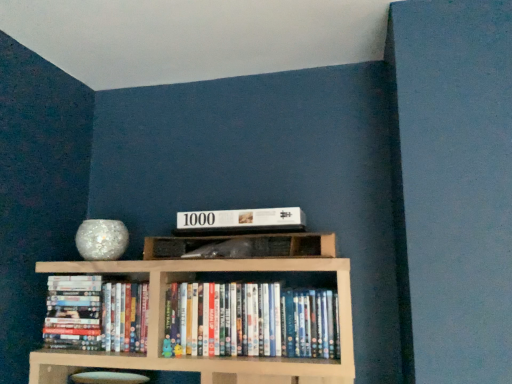
The width and height of the screenshot is (512, 384). Describe the element at coordinates (246, 239) in the screenshot. I see `wooden shelf at center` at that location.

At what (x,y) coordinates should I click in order to perform the action: click on white glossy dvd case at center, acting as the 2th book starting from the left. Please return your answer as a coordinate pair (x, y). Looking at the image, I should click on (250, 321).

From the image's perspective, between white matte puzzle box at center and white glossy dvd case at center, the first book when ordered from right to left, who is located below?

white glossy dvd case at center, the first book when ordered from right to left.

Is white matte puzzle box at center wider or thinner than white glossy dvd case at center, the first book when ordered from right to left?

In the image, white matte puzzle box at center appears to be wider than white glossy dvd case at center, the first book when ordered from right to left.

From a real-world perspective, is white matte puzzle box at center physically located above or below white glossy dvd case at center, the first book when ordered from right to left?

From a real-world perspective, white matte puzzle box at center is physically above white glossy dvd case at center, the first book when ordered from right to left.

Can you confirm if white matte puzzle box at center is bigger than white glossy dvd case at center, the first book when ordered from right to left?

Actually, white matte puzzle box at center might be smaller than white glossy dvd case at center, the first book when ordered from right to left.

Is hardcover books at center, acting as the 2th book starting from the right, facing towards white glossy dvd case at center, acting as the 2th book starting from the left?

No, hardcover books at center, acting as the 2th book starting from the right, is not oriented towards white glossy dvd case at center, acting as the 2th book starting from the left.

Can you tell me how much hardcover books at center, placed as the 1th book when sorted from left to right, and white glossy dvd case at center, the first book when ordered from right to left, differ in facing direction?

There is a 0.000486-degree angle between the facing directions of hardcover books at center, placed as the 1th book when sorted from left to right, and white glossy dvd case at center, the first book when ordered from right to left.

Where is `book behind the white glossy dvd case at center, the first book when ordered from right to left`? This screenshot has height=384, width=512. book behind the white glossy dvd case at center, the first book when ordered from right to left is located at coordinates (96, 314).

Considering the positions of objects hardcover books at center, placed as the 1th book when sorted from left to right, and white glossy dvd case at center, the first book when ordered from right to left, in the image provided, who is in front, hardcover books at center, placed as the 1th book when sorted from left to right, or white glossy dvd case at center, the first book when ordered from right to left,?

white glossy dvd case at center, the first book when ordered from right to left.

Is wooden shelf at center shorter than white glossy dvd case at center, the first book when ordered from right to left?

Yes, wooden shelf at center is shorter than white glossy dvd case at center, the first book when ordered from right to left.

Does wooden shelf at center turn towards white glossy dvd case at center, the first book when ordered from right to left?

No, wooden shelf at center is not aimed at white glossy dvd case at center, the first book when ordered from right to left.

In the scene shown: From the image's perspective, which is above, wooden shelf at center or white glossy dvd case at center, acting as the 2th book starting from the left?

wooden shelf at center is shown above in the image.

Which is in front, wooden shelf at center or white glossy dvd case at center, acting as the 2th book starting from the left?

wooden shelf at center.

Does hardcover books at center, placed as the 1th book when sorted from left to right, have a greater width compared to white matte puzzle box at center?

In fact, hardcover books at center, placed as the 1th book when sorted from left to right, might be narrower than white matte puzzle box at center.

Is hardcover books at center, acting as the 2th book starting from the right, in front of or behind white matte puzzle box at center in the image?

hardcover books at center, acting as the 2th book starting from the right, is positioned farther from the viewer than white matte puzzle box at center.

Is hardcover books at center, acting as the 2th book starting from the right, next to white matte puzzle box at center?

There is a gap between hardcover books at center, acting as the 2th book starting from the right, and white matte puzzle box at center.

From a real-world perspective, is white glossy dvd case at center, acting as the 2th book starting from the left, positioned over hardcover books at center, acting as the 2th book starting from the right, based on gravity?

No, from a real-world perspective, white glossy dvd case at center, acting as the 2th book starting from the left, is not on top of hardcover books at center, acting as the 2th book starting from the right.

Are white glossy dvd case at center, acting as the 2th book starting from the left, and hardcover books at center, placed as the 1th book when sorted from left to right, located far from each other?

Actually, white glossy dvd case at center, acting as the 2th book starting from the left, and hardcover books at center, placed as the 1th book when sorted from left to right, are a little close together.

Does point (316, 299) lie behind point (106, 305)?

No, it is in front of (106, 305).

Is hardcover books at center, placed as the 1th book when sorted from left to right, at the back of white glossy dvd case at center, the first book when ordered from right to left?

That's not correct — white glossy dvd case at center, the first book when ordered from right to left, is not looking away from hardcover books at center, placed as the 1th book when sorted from left to right.

Considering the relative sizes of wooden shelf at center and hardcover books at center, acting as the 2th book starting from the right, in the image provided, is wooden shelf at center bigger than hardcover books at center, acting as the 2th book starting from the right,?

Incorrect, wooden shelf at center is not larger than hardcover books at center, acting as the 2th book starting from the right.

Is wooden shelf at center facing away from hardcover books at center, placed as the 1th book when sorted from left to right?

No, wooden shelf at center's orientation is not away from hardcover books at center, placed as the 1th book when sorted from left to right.

Would you say wooden shelf at center is a long distance from hardcover books at center, acting as the 2th book starting from the right?

No, wooden shelf at center is in close proximity to hardcover books at center, acting as the 2th book starting from the right.

Considering the sizes of wooden shelf at center and white matte puzzle box at center in the image, is wooden shelf at center bigger or smaller than white matte puzzle box at center?

wooden shelf at center is bigger than white matte puzzle box at center.

Is wooden shelf at center aimed at white matte puzzle box at center?

No, wooden shelf at center is not turned towards white matte puzzle box at center.

Based on the photo, who is taller, wooden shelf at center or white matte puzzle box at center?

wooden shelf at center.

This screenshot has width=512, height=384. What are the coordinates of `the 2nd book located beneath the white matte puzzle box at center (from a real-world perspective)` in the screenshot? It's located at (250, 321).

The image size is (512, 384). In order to click on book located above the hardcover books at center, acting as the 2th book starting from the right (from the image's perspective) in this screenshot , I will do (x=250, y=321).

From the image, which object appears to be farther from wooden shelf at center, white matte puzzle box at center or hardcover books at center, acting as the 2th book starting from the right?

Based on the image, hardcover books at center, acting as the 2th book starting from the right, appears to be further to wooden shelf at center.

From the image, which object appears to be nearer to hardcover books at center, placed as the 1th book when sorted from left to right, white matte puzzle box at center or wooden shelf at center?

wooden shelf at center.

Based on their spatial positions, is white glossy dvd case at center, the first book when ordered from right to left, or wooden shelf at center closer to white matte puzzle box at center?

Based on the image, wooden shelf at center appears to be nearer to white matte puzzle box at center.

Considering their positions, is white matte puzzle box at center positioned closer to wooden shelf at center than white glossy dvd case at center, the first book when ordered from right to left?

white matte puzzle box at center.

When comparing their distances from white matte puzzle box at center, does hardcover books at center, placed as the 1th book when sorted from left to right, or wooden shelf at center seem further?

hardcover books at center, placed as the 1th book when sorted from left to right.

Which object lies nearer to the anchor point hardcover books at center, placed as the 1th book when sorted from left to right, white glossy dvd case at center, acting as the 2th book starting from the left, or white matte puzzle box at center?

white glossy dvd case at center, acting as the 2th book starting from the left, is closer to hardcover books at center, placed as the 1th book when sorted from left to right.

Consider the image. Which object lies further to the anchor point white glossy dvd case at center, acting as the 2th book starting from the left, hardcover books at center, acting as the 2th book starting from the right, or wooden shelf at center?

hardcover books at center, acting as the 2th book starting from the right, is positioned further to the anchor white glossy dvd case at center, acting as the 2th book starting from the left.

In the scene shown: Considering their positions, is wooden shelf at center positioned further to hardcover books at center, placed as the 1th book when sorted from left to right, than white matte puzzle box at center?

Among the two, white matte puzzle box at center is located further to hardcover books at center, placed as the 1th book when sorted from left to right.

At what (x,y) coordinates should I click in order to perform the action: click on paperback book located between hardcover books at center, placed as the 1th book when sorted from left to right, and white glossy dvd case at center, acting as the 2th book starting from the left, in the left-right direction. Please return your answer as a coordinate pair (x, y). The image size is (512, 384). Looking at the image, I should click on (241, 220).

In order to click on shelf situated between hardcover books at center, acting as the 2th book starting from the right, and white glossy dvd case at center, the first book when ordered from right to left, from left to right in this screenshot , I will do `click(246, 239)`.

Locate an element on the screen. The height and width of the screenshot is (384, 512). paperback book located between hardcover books at center, acting as the 2th book starting from the right, and wooden shelf at center in the left-right direction is located at coordinates 241,220.

Find the location of a particular element. shelf between white matte puzzle box at center and white glossy dvd case at center, the first book when ordered from right to left, in the up-down direction is located at coordinates (x=246, y=239).